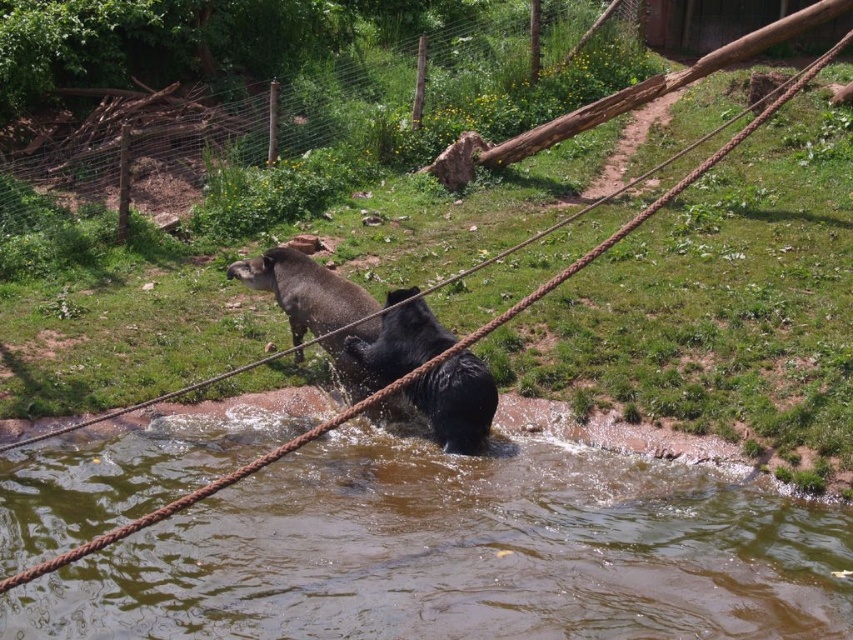
You are a zookeeper observing the enclosure. You need to assess the distance between the brown muddy water at lower center and the shiny black bear at center. Which one is nearer to you?

The brown muddy water at lower center is closer to the viewer than the shiny black bear at center.

You are a zookeeper planning to place a new feeding station in the enclosure. The feeding station requires a clear area free of water to avoid contamination. Based on the image, where should you position it to ensure it stays away from the brown muddy water at lower center?

The brown muddy water at lower center is located at point [460,554]. To avoid contamination, position the feeding station away from this coordinate, preferably in the grassy areas of the enclosure described in the scene.